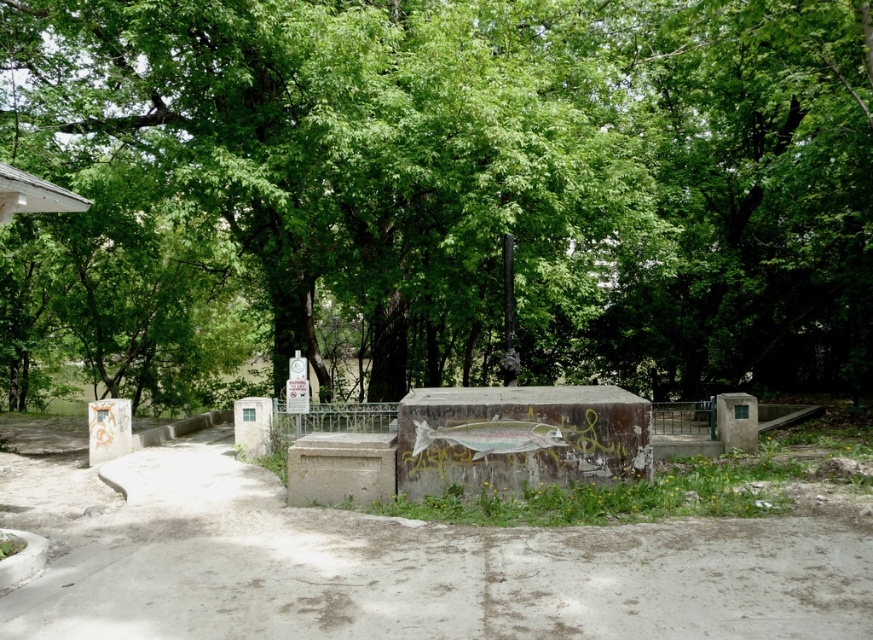
Between green leafy tree at center and concrete at center, which one appears on the right side from the viewer's perspective?

green leafy tree at center is more to the right.

Is the position of green leafy tree at center more distant than that of concrete at center?

Yes, it is behind concrete at center.

Does point (432, 76) lie behind point (152, 458)?

No, it is not.

Where is `green leafy tree at center`? The width and height of the screenshot is (873, 640). green leafy tree at center is located at coordinates (440, 192).